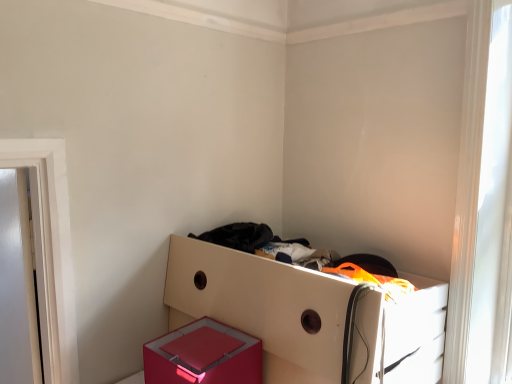
Question: Could you tell me if transparent glass window at upper right is turned towards white glossy drawer at center?

Choices:
 (A) yes
 (B) no

Answer: (B)

Question: Is transparent glass window at upper right not close to white glossy drawer at center?

Choices:
 (A) no
 (B) yes

Answer: (A)

Question: Is transparent glass window at upper right closer to the viewer compared to white glossy drawer at center?

Choices:
 (A) no
 (B) yes

Answer: (A)

Question: From the image's perspective, does transparent glass window at upper right appear lower than white glossy drawer at center?

Choices:
 (A) yes
 (B) no

Answer: (B)

Question: Can you confirm if transparent glass window at upper right is bigger than white glossy drawer at center?

Choices:
 (A) no
 (B) yes

Answer: (A)

Question: Does point (489, 69) appear closer or farther from the camera than point (265, 261)?

Choices:
 (A) farther
 (B) closer

Answer: (A)

Question: Looking at the image, does transparent glass window at upper right seem bigger or smaller compared to white glossy drawer at center?

Choices:
 (A) big
 (B) small

Answer: (B)

Question: Do you think transparent glass window at upper right is within white glossy drawer at center, or outside of it?

Choices:
 (A) outside
 (B) inside

Answer: (A)

Question: From their relative heights in the image, would you say transparent glass window at upper right is taller or shorter than white glossy drawer at center?

Choices:
 (A) tall
 (B) short

Answer: (A)

Question: Does point (250, 365) appear closer or farther from the camera than point (509, 259)?

Choices:
 (A) farther
 (B) closer

Answer: (B)

Question: Considering the positions of shiny pink box at lower center and transparent glass window at upper right in the image, is shiny pink box at lower center bigger or smaller than transparent glass window at upper right?

Choices:
 (A) small
 (B) big

Answer: (B)

Question: Is shiny pink box at lower center in front of or behind transparent glass window at upper right in the image?

Choices:
 (A) front
 (B) behind

Answer: (A)

Question: Is shiny pink box at lower center taller or shorter than transparent glass window at upper right?

Choices:
 (A) tall
 (B) short

Answer: (B)

Question: Does point (162, 357) appear closer or farther from the camera than point (317, 337)?

Choices:
 (A) farther
 (B) closer

Answer: (A)

Question: Considering their positions, is shiny pink box at lower center located in front of or behind white glossy drawer at center?

Choices:
 (A) behind
 (B) front

Answer: (A)